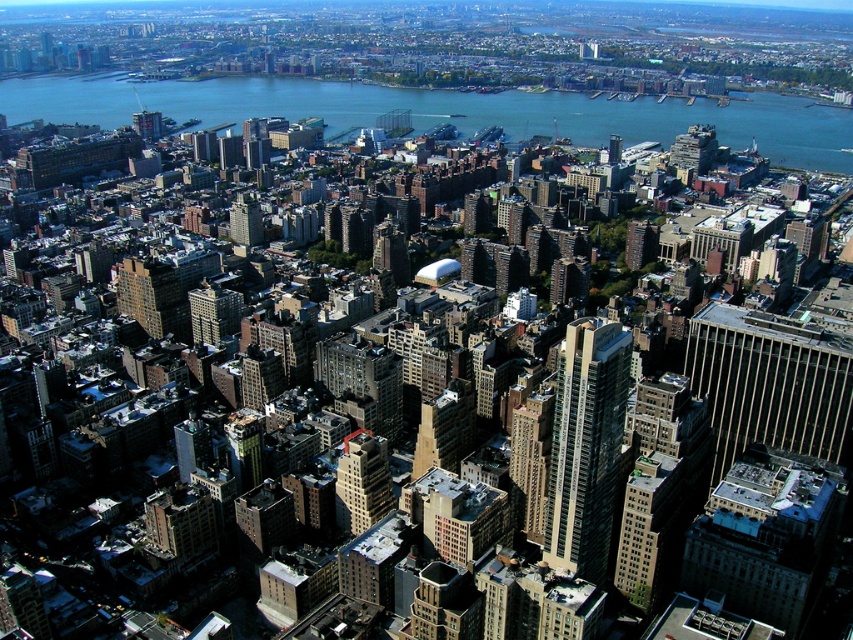
Can you confirm if gold glass skyscraper at right is wider than brown brick building at center?

Yes.

Is point (772, 317) farther from camera compared to point (363, 481)?

That is True.

At what (x,y) coordinates should I click in order to perform the action: click on gold glass skyscraper at right. Please return your answer as a coordinate pair (x, y). The height and width of the screenshot is (640, 853). Looking at the image, I should click on (770, 384).

Where is `gold glass skyscraper at right`? The width and height of the screenshot is (853, 640). gold glass skyscraper at right is located at coordinates (770, 384).

Between blue water at center and gold glass skyscraper at right, which one is positioned higher?

Positioned higher is blue water at center.

Is blue water at center positioned before gold glass skyscraper at right?

No, it is not.

What are the coordinates of `blue water at center` in the screenshot? It's located at (448, 112).

Who is lower down, blue water at center or glassy steel skyscraper at center-right?

glassy steel skyscraper at center-right is below.

Between blue water at center and glassy steel skyscraper at center-right, which one is positioned higher?

Positioned higher is blue water at center.

The image size is (853, 640). Describe the element at coordinates (448, 112) in the screenshot. I see `blue water at center` at that location.

Identify the location of blue water at center. (448, 112).